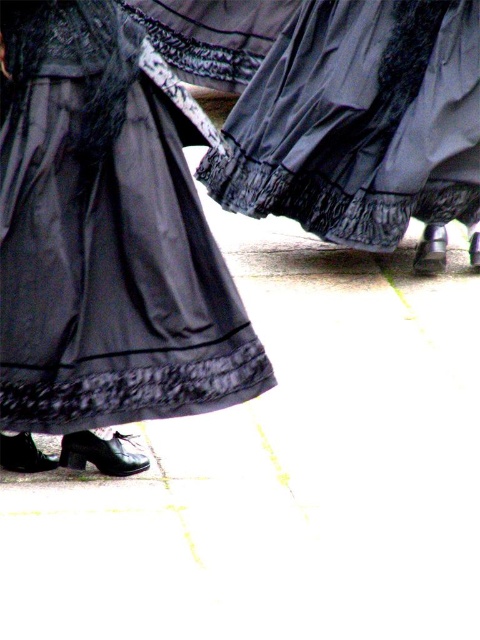
You are a photographer setting up a shoot and need to position a light source to the right of the matte black skirt at center. Which object should you place the light to the right of to ensure the satin black dress at lower left is also illuminated?

You should place the light to the right of the matte black skirt at center. Since the satin black dress at lower left is to the left of the matte black skirt at center, positioning the light to the right of the skirt will also illuminate the dress.

You are a photographer trying to capture the intricate lace details of both the satin black dress at lower left and the matte black skirt at center. Since you can only focus on one at a time, which one should you adjust your camera to focus on first if you want to ensure the one that is closer to the foreground is in sharp detail?

The satin black dress at lower left is positioned under the matte black skirt at center, meaning the matte black skirt at center is closer to the foreground. Therefore, you should focus on the matte black skirt at center first to capture its lace details sharply.

You are a photographer setting up a shoot in a studio. You have a camera with a focal length of 2 meters. You need to capture both the satin black dress at lower left and the matte black skirt at center in the same frame. Can you position yourself so that both objects are within the camera lens range?

The distance between the satin black dress at lower left and the matte black skirt at center is 2.39 meters. Since the camera has a focal length of 2 meters, which is shorter than the required distance, you cannot capture both objects in the same frame without moving closer or using a different lens.